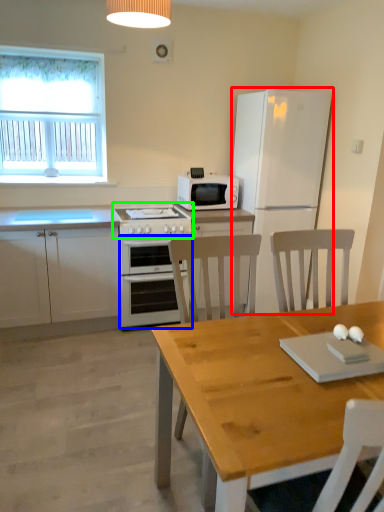
Question: Which object is positioned farthest from refrigerator (highlighted by a red box)? Select from oven (highlighted by a blue box) and gas stove (highlighted by a green box).

Choices:
 (A) oven
 (B) gas stove

Answer: (A)